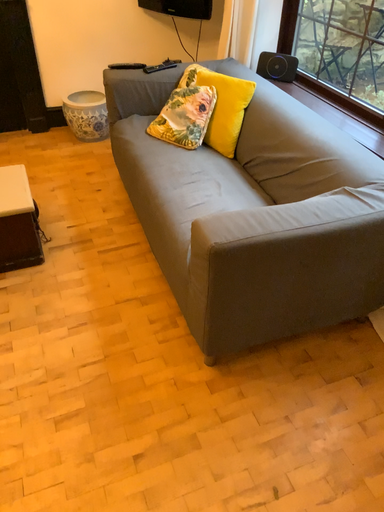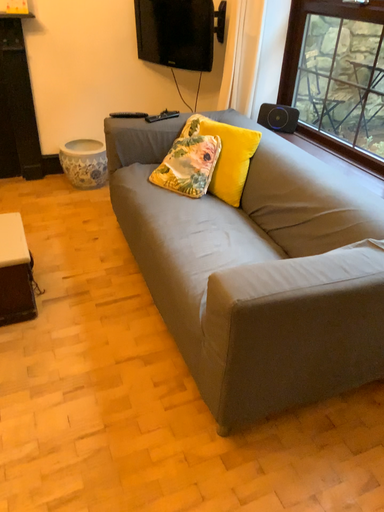
Question: How did the camera likely rotate when shooting the video?

Choices:
 (A) rotated upward
 (B) rotated downward

Answer: (A)